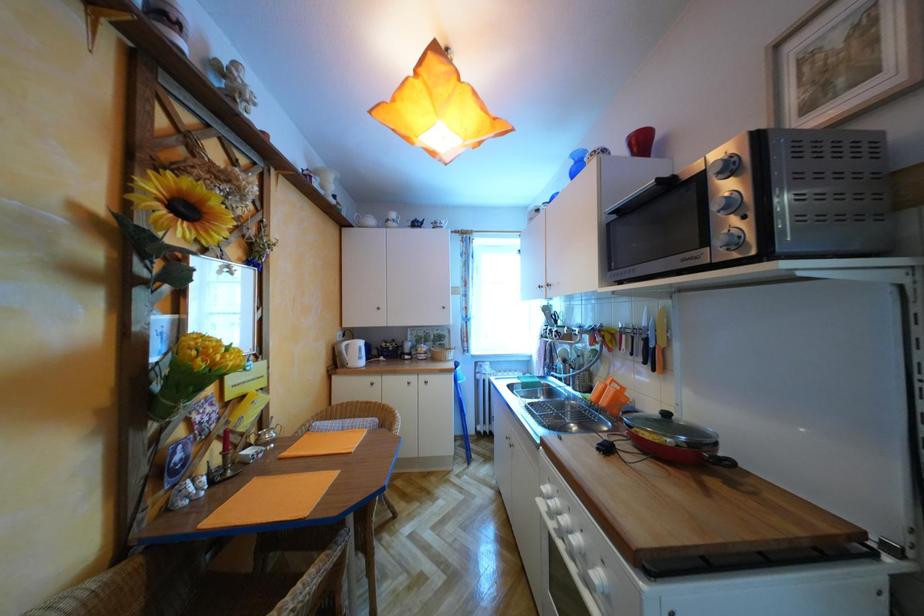
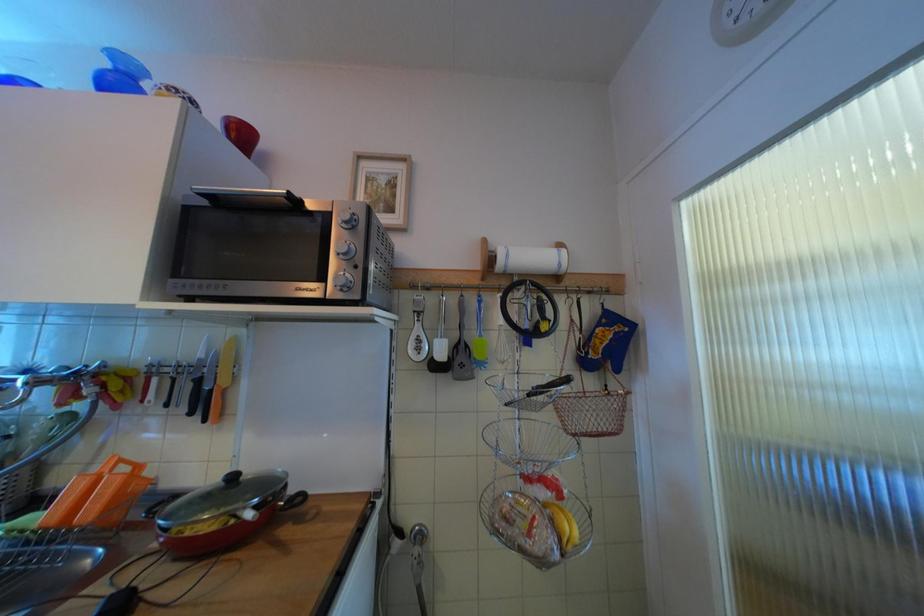
Question: The camera is either moving clockwise (left) or counter-clockwise (right) around the object. The first image is from the beginning of the video and the second image is from the end. Is the camera moving left or right when shooting the video?

Choices:
 (A) Left
 (B) Right

Answer: (A)